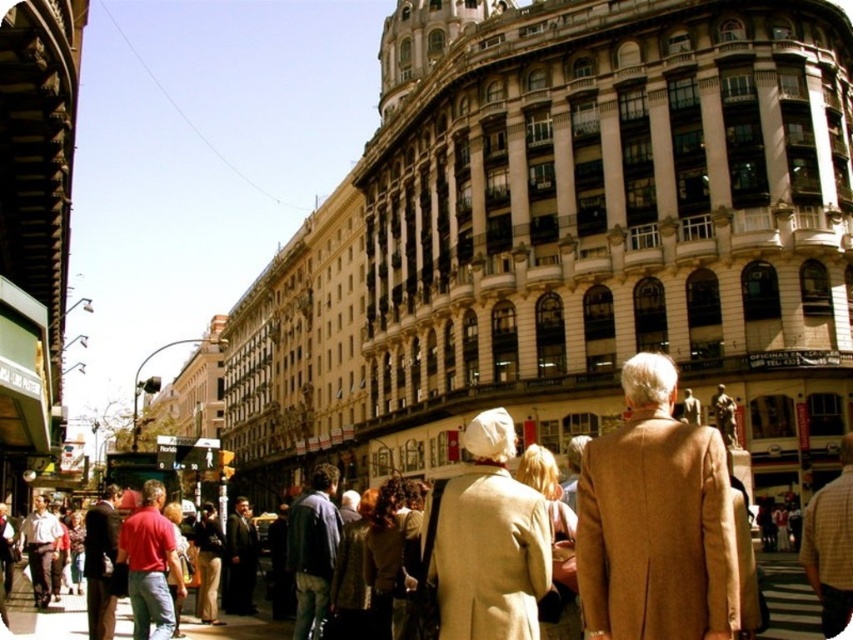
Does beige wool coat at center have a lesser height compared to smooth asphalt pavement at center?

No.

Does beige wool coat at center appear under smooth asphalt pavement at center?

Actually, beige wool coat at center is above smooth asphalt pavement at center.

Is point (503, 554) positioned in front of point (807, 612)?

Yes.

Locate an element on the screen. The width and height of the screenshot is (853, 640). beige wool coat at center is located at coordinates (489, 540).

Who is positioned more to the right, tan wool coat at center or beige wool coat at center?

tan wool coat at center is more to the right.

Can you confirm if tan wool coat at center is smaller than beige wool coat at center?

No.

Is point (651, 616) positioned after point (527, 499)?

That is False.

Where is `tan wool coat at center`? The width and height of the screenshot is (853, 640). tan wool coat at center is located at coordinates (656, 520).

Does tan wool coat at center appear over smooth asphalt pavement at center?

Indeed, tan wool coat at center is positioned over smooth asphalt pavement at center.

Is tan wool coat at center taller than smooth asphalt pavement at center?

Indeed, tan wool coat at center has a greater height compared to smooth asphalt pavement at center.

Who is more forward, (643, 381) or (198, 627)?

Positioned in front is point (643, 381).

The height and width of the screenshot is (640, 853). What are the coordinates of `tan wool coat at center` in the screenshot? It's located at (656, 520).